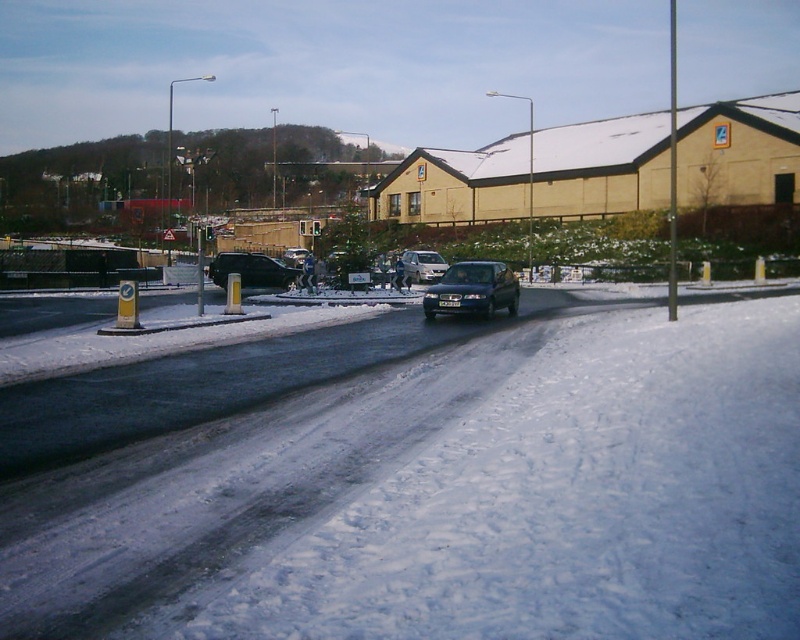
Question: Which of the following is the closest to the observer?

Choices:
 (A) (214, 260)
 (B) (308, 250)
 (C) (498, 275)
 (D) (428, 259)

Answer: (C)

Question: Is glossy dark blue car at center further to camera compared to shiny black car at center?

Choices:
 (A) yes
 (B) no

Answer: (B)

Question: Which of the following is the closest to the observer?

Choices:
 (A) satin silver van at center
 (B) shiny black car at center

Answer: (B)

Question: Can you confirm if glossy dark blue car at center is smaller than satin silver van at center?

Choices:
 (A) no
 (B) yes

Answer: (A)

Question: Is glossy dark blue car at center bigger than shiny black sedan at center?

Choices:
 (A) no
 (B) yes

Answer: (B)

Question: Estimate the real-world distances between objects in this image. Which object is closer to the satin silver van at center?

Choices:
 (A) shiny black sedan at center
 (B) shiny black car at center
 (C) glossy dark blue car at center

Answer: (B)